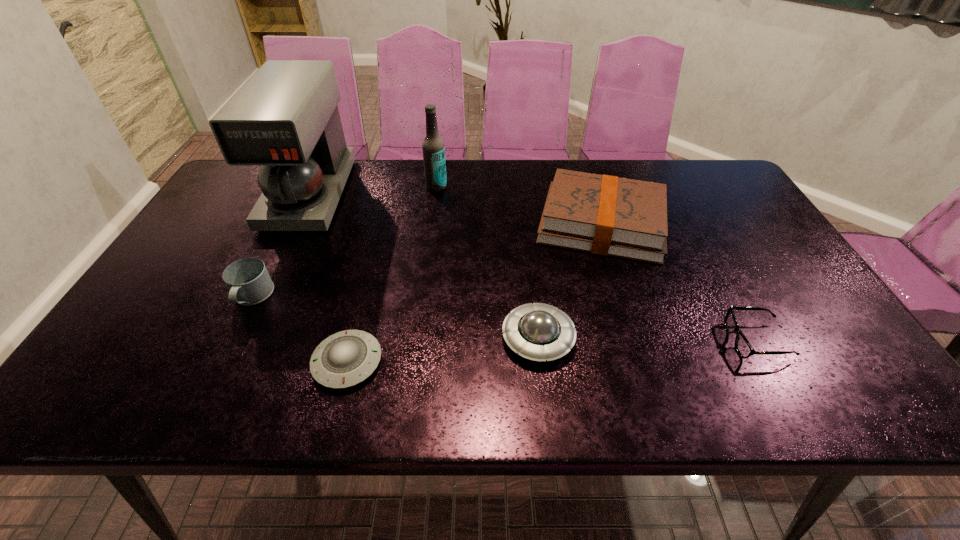
This screenshot has width=960, height=540. In order to click on empty space between the rightmost object and the third tallest object in this screenshot , I will do `click(679, 282)`.

Where is `empty location between the sixth shortest object and the shorter saucer`? empty location between the sixth shortest object and the shorter saucer is located at coordinates (392, 274).

Identify the location of free space between the taller saucer and the sunglasses. (647, 339).

Find the location of `vacant area between the fifth shortest object and the rightmost object`. vacant area between the fifth shortest object and the rightmost object is located at coordinates (679, 282).

Image resolution: width=960 pixels, height=540 pixels. Identify the location of free space between the fifth shortest object and the mug. (426, 261).

You are a GUI agent. You are given a task and a screenshot of the screen. Output one action in this format:
    pyautogui.click(x=<x>, y=<y>)
    Task: Click on the object that is the fourth closest to the rightmost object
    Image resolution: width=960 pixels, height=540 pixels.
    Given the screenshot: What is the action you would take?
    pyautogui.click(x=433, y=148)

The image size is (960, 540). In order to click on object that is the second closest one to the rightmost object in this screenshot , I will do pos(539,332).

You are a GUI agent. You are given a task and a screenshot of the screen. Output one action in this format:
    pyautogui.click(x=<x>, y=<y>)
    Task: Click on the free spot that satisfies the following two spatial constraints: 1. on the label of the right saucer; 2. on the right side of the fourth object from left to right
    This screenshot has height=540, width=960.
    Given the screenshot: What is the action you would take?
    pyautogui.click(x=418, y=338)

Where is `vacant point that satisfies the following two spatial constraints: 1. on the carafe side of the coffee maker; 2. on the left side of the taller saucer`? vacant point that satisfies the following two spatial constraints: 1. on the carafe side of the coffee maker; 2. on the left side of the taller saucer is located at coordinates (242, 338).

Where is `free space that satisfies the following two spatial constraints: 1. on the label of the third tallest object; 2. on the right side of the fourth object from left to right`? Image resolution: width=960 pixels, height=540 pixels. free space that satisfies the following two spatial constraints: 1. on the label of the third tallest object; 2. on the right side of the fourth object from left to right is located at coordinates (432, 225).